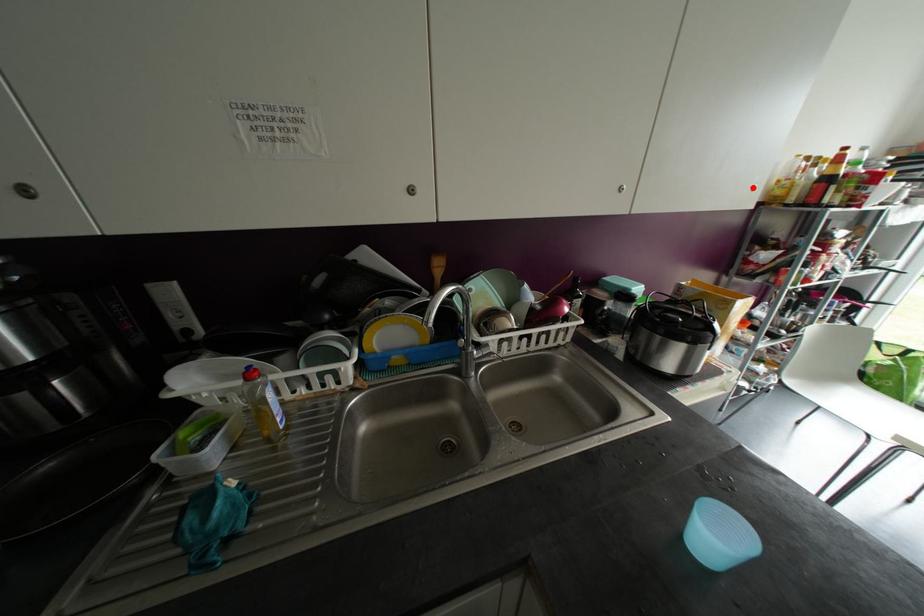
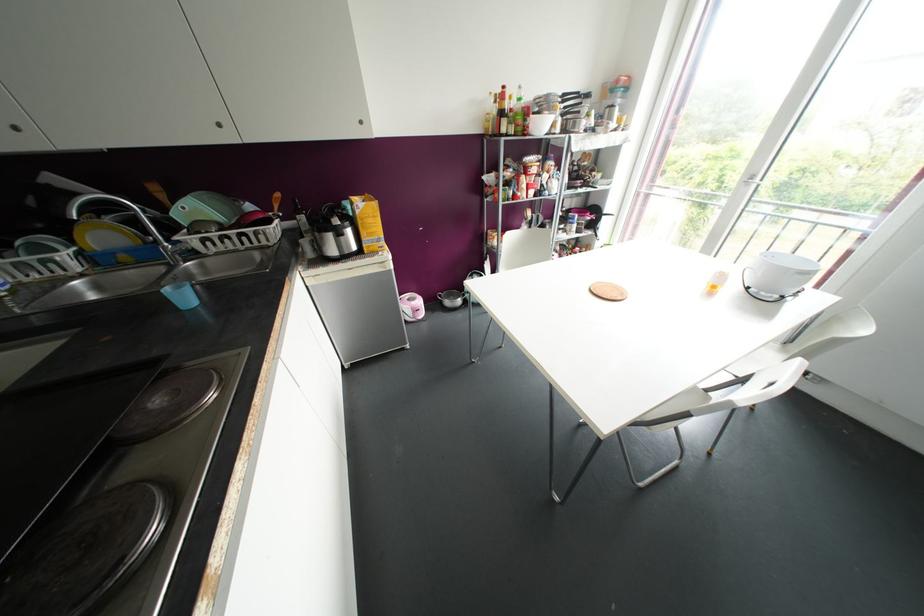
The point at the highlighted location is marked in the first image. Where is the corresponding point in the second image?

(360, 122)